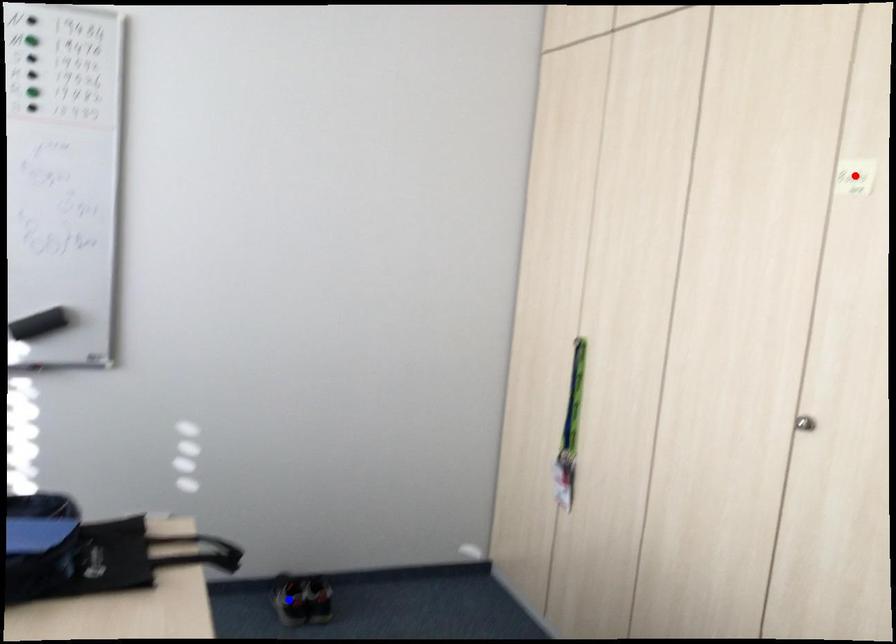
Question: In the image, two points are highlighted. Which point is nearer to the camera? Reply with the corresponding letter.

Choices:
 (A) blue point
 (B) red point

Answer: (B)